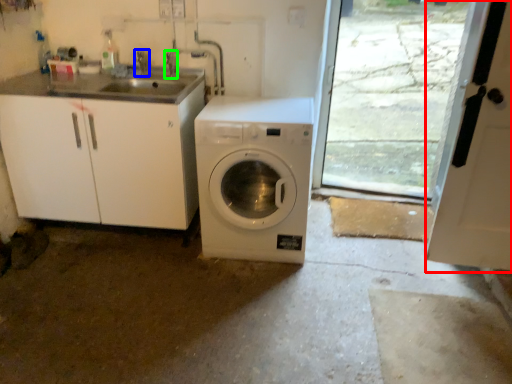
Question: Estimate the real-world distances between objects in this image. Which object is farther from screen door (highlighted by a red box), faucet (highlighted by a blue box) or faucet (highlighted by a green box)?

Choices:
 (A) faucet
 (B) faucet

Answer: (A)